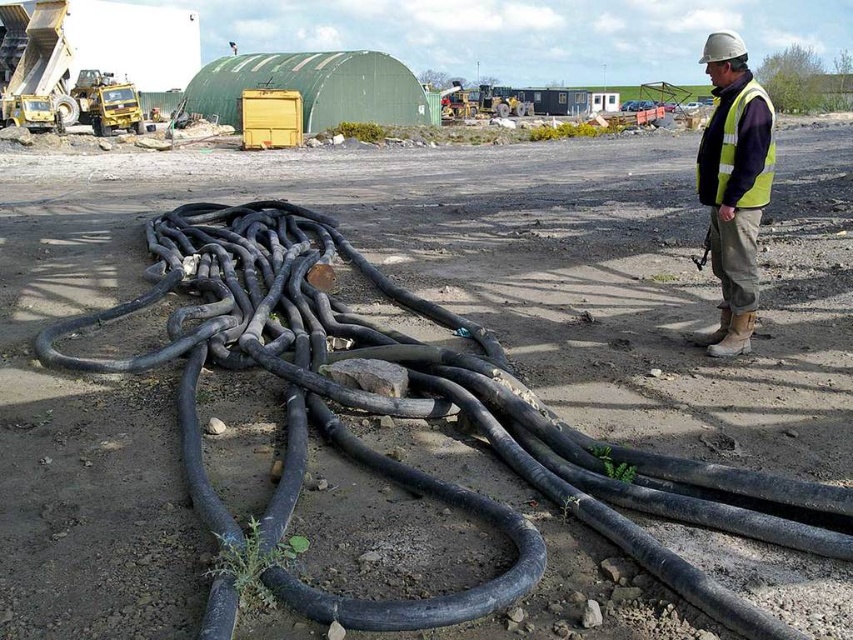
Question: Estimate the real-world distances between objects in this image. Which object is farther from the high-visibility fabric safety vest at right?

Choices:
 (A) yellow reflective vest at right
 (B) black rubber garden hose at lower center

Answer: (B)

Question: Is black rubber garden hose at lower center closer to the viewer compared to yellow reflective vest at right?

Choices:
 (A) no
 (B) yes

Answer: (B)

Question: Among these points, which one is farthest from the camera?

Choices:
 (A) (740, 148)
 (B) (689, 570)

Answer: (A)

Question: Is black rubber garden hose at lower center bigger than high-visibility fabric safety vest at right?

Choices:
 (A) no
 (B) yes

Answer: (A)

Question: Can you confirm if black rubber garden hose at lower center is bigger than high-visibility fabric safety vest at right?

Choices:
 (A) no
 (B) yes

Answer: (A)

Question: Which of the following is the closest to the observer?

Choices:
 (A) yellow reflective vest at right
 (B) high-visibility fabric safety vest at right

Answer: (A)